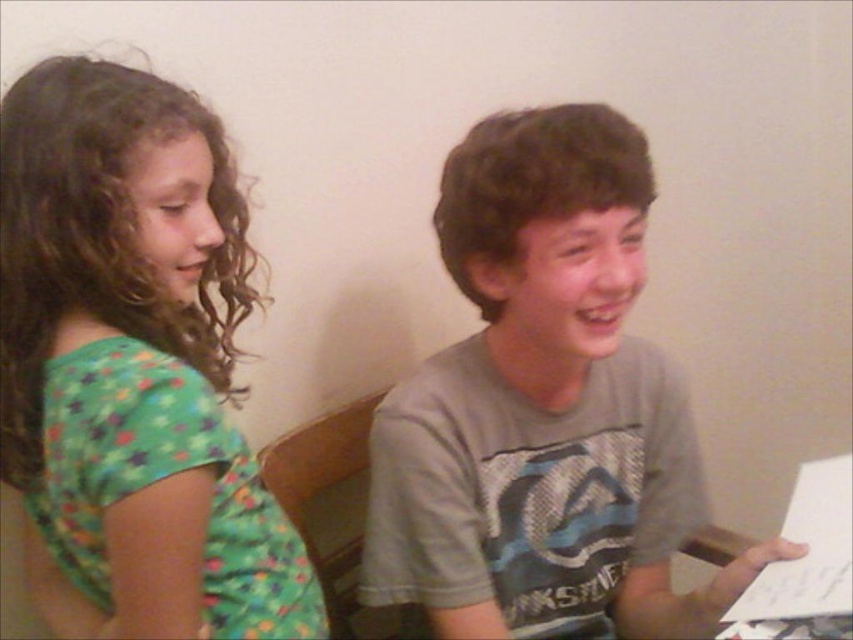
Question: Which object is closer to the camera taking this photo?

Choices:
 (A) gray cotton shirt at center
 (B) green printed shirt at left

Answer: (B)

Question: Can you confirm if green printed shirt at left is smaller than gray cotton shirt at center?

Choices:
 (A) yes
 (B) no

Answer: (B)

Question: Can you confirm if green printed shirt at left is thinner than gray cotton shirt at center?

Choices:
 (A) yes
 (B) no

Answer: (A)

Question: Does green printed shirt at left appear on the left side of gray cotton shirt at center?

Choices:
 (A) yes
 (B) no

Answer: (A)